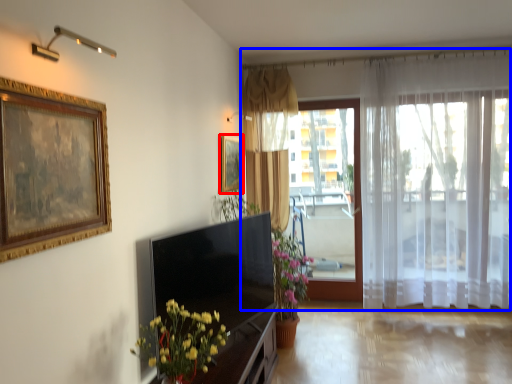
Question: Which object is further to the camera taking this photo, picture frame (highlighted by a red box) or curtain (highlighted by a blue box)?

Choices:
 (A) picture frame
 (B) curtain

Answer: (B)